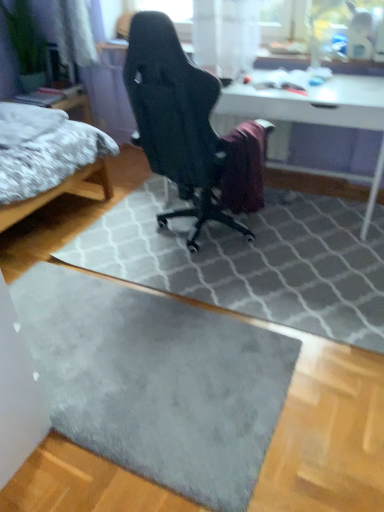
This screenshot has width=384, height=512. Find the location of `free space on the front side of black mesh chair at center`. free space on the front side of black mesh chair at center is located at coordinates (233, 284).